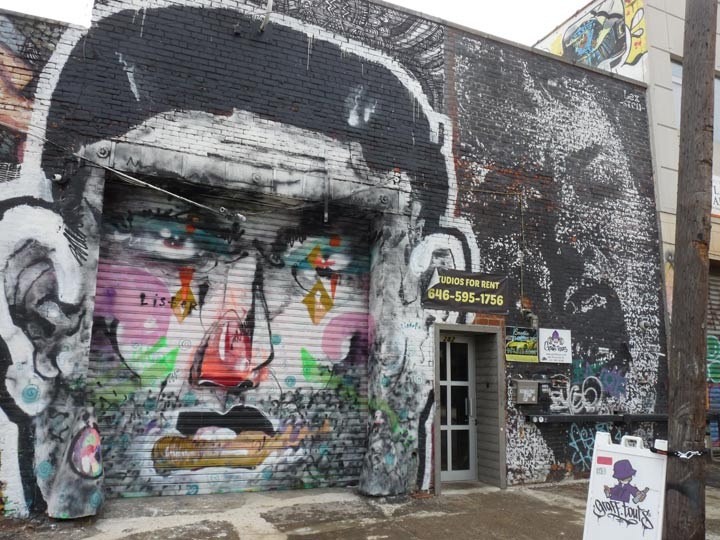
The height and width of the screenshot is (540, 720). I want to click on door, so click(451, 403).